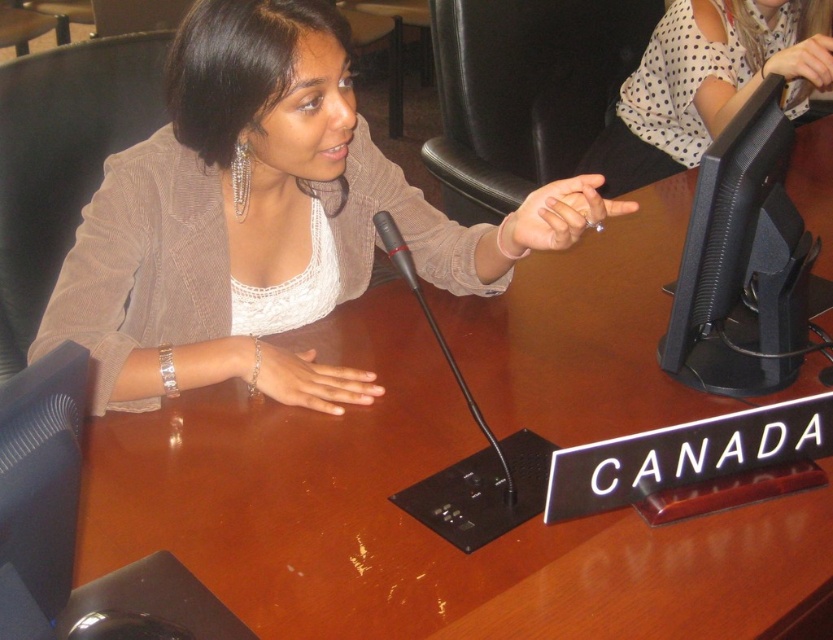
Question: Which object is positioned closest to the matte beige sweater at upper left?

Choices:
 (A) clear acrylic ring at center
 (B) light skin tone flesh at center
 (C) black plastic monitor at right

Answer: (B)

Question: Observing the image, what is the correct spatial positioning of white dotted blouse at upper right in reference to black plastic microphone at center?

Choices:
 (A) right
 (B) left

Answer: (A)

Question: Is black plastic monitor at right smaller than white dotted blouse at upper right?

Choices:
 (A) no
 (B) yes

Answer: (B)

Question: Where is white dotted blouse at upper right located in relation to clear acrylic ring at center in the image?

Choices:
 (A) above
 (B) below

Answer: (A)

Question: Which object appears closest to the camera in this image?

Choices:
 (A) black plastic microphone at center
 (B) black plastic monitor at right

Answer: (B)

Question: Which point is closer to the camera?

Choices:
 (A) matte black hand at upper right
 (B) light skin tone flesh at center
 (C) black plastic monitor at right
 (D) black plastic microphone at center

Answer: (C)